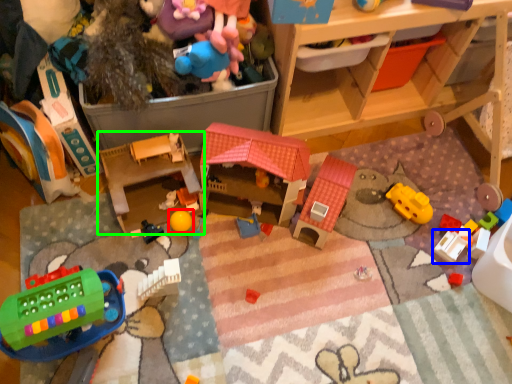
Question: Considering the real-world distances, which object is closest to toy (highlighted by a red box)? toy (highlighted by a blue box) or toy (highlighted by a green box).

Choices:
 (A) toy
 (B) toy

Answer: (B)